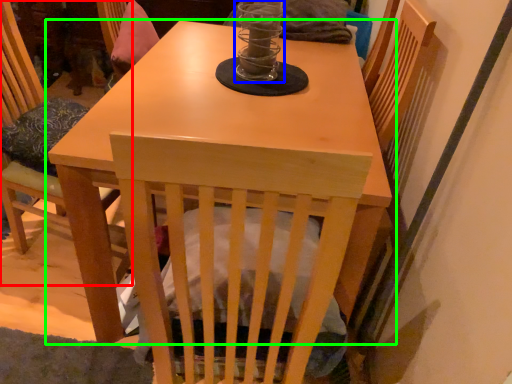
Question: Estimate the real-world distances between objects in this image. Which object is closer to chair (highlighted by a red box), candle holder (highlighted by a blue box) or table (highlighted by a green box)?

Choices:
 (A) candle holder
 (B) table

Answer: (B)